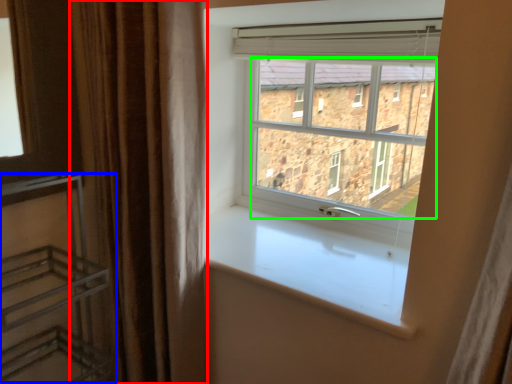
Question: Which is farther away from curtain (highlighted by a red box)? shelf (highlighted by a blue box) or window screen (highlighted by a green box)?

Choices:
 (A) shelf
 (B) window screen

Answer: (B)